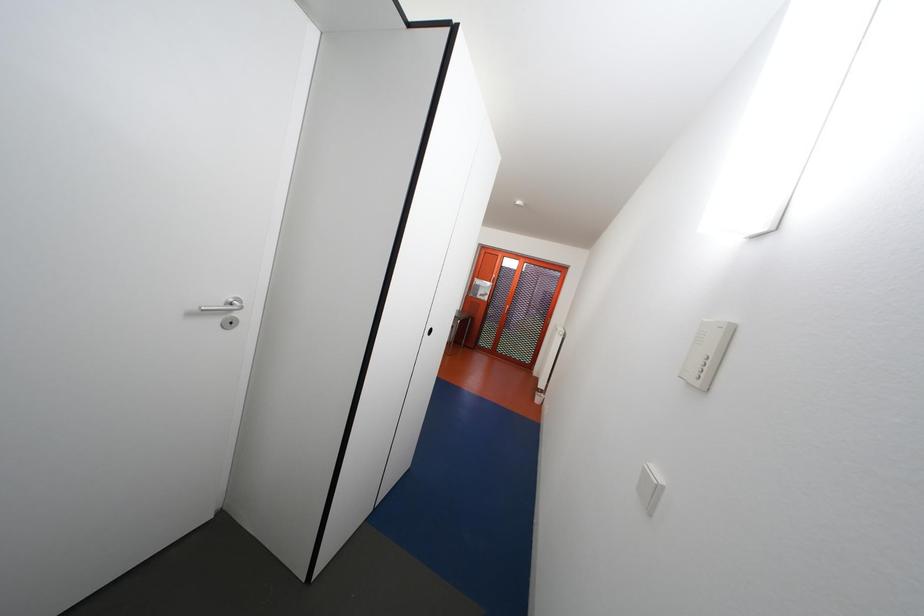
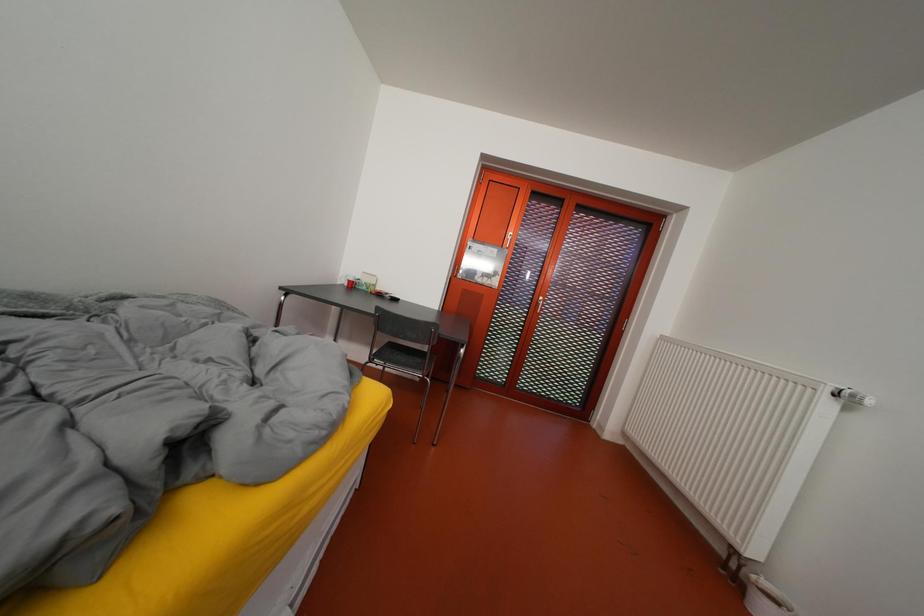
Question: Which direction would the cameraman need to move to produce the second image? Reply with the corresponding letter.

Choices:
 (A) Left
 (B) Right
 (C) Forward
 (D) Backward

Answer: (C)